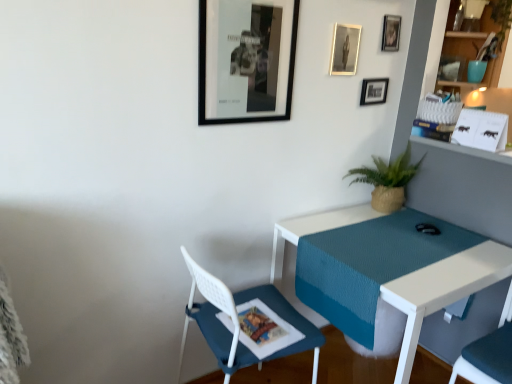
Question: Is fabric cushioned chair at lower right, the first chair from the right, smaller than black matte picture frame at upper center, the first picture frame when ordered from front to back?

Choices:
 (A) yes
 (B) no

Answer: (B)

Question: Would you say fabric cushioned chair at lower right, positioned as the 2th chair in left-to-right order, contains black matte picture frame at upper center, which is counted as the fourth picture frame, starting from the back?

Choices:
 (A) yes
 (B) no

Answer: (B)

Question: From a real-world perspective, is fabric cushioned chair at lower right, positioned as the 2th chair in left-to-right order, below black matte picture frame at upper center, the first picture frame when ordered from front to back?

Choices:
 (A) yes
 (B) no

Answer: (A)

Question: Would you say fabric cushioned chair at lower right, the first chair from the right, is outside black matte picture frame at upper center, positioned as the 1th picture frame in left-to-right order?

Choices:
 (A) no
 (B) yes

Answer: (B)

Question: Does fabric cushioned chair at lower right, the first chair from the right, lie in front of black matte picture frame at upper center, the first picture frame when ordered from front to back?

Choices:
 (A) yes
 (B) no

Answer: (A)

Question: Is fabric cushioned chair at lower right, positioned as the 2th chair in left-to-right order, positioned with its back to black matte picture frame at upper center, which is the 4th picture frame in right-to-left order?

Choices:
 (A) yes
 (B) no

Answer: (B)

Question: Is metallic silver picture frame at upper center, the 3th picture frame in the left-to-right sequence, thinner than metallic silver photo frame at upper center, which ranks as the second picture frame in front-to-back order?

Choices:
 (A) yes
 (B) no

Answer: (B)

Question: Considering the relative positions of metallic silver picture frame at upper center, marked as the second picture frame in a right-to-left arrangement, and metallic silver photo frame at upper center, which ranks as the second picture frame in front-to-back order, in the image provided, is metallic silver picture frame at upper center, marked as the second picture frame in a right-to-left arrangement, to the left of metallic silver photo frame at upper center, which ranks as the second picture frame in front-to-back order, from the viewer's perspective?

Choices:
 (A) yes
 (B) no

Answer: (B)

Question: Does metallic silver picture frame at upper center, the 3th picture frame in the left-to-right sequence, have a greater height compared to metallic silver photo frame at upper center, which appears as the 3th picture frame when viewed from the right?

Choices:
 (A) no
 (B) yes

Answer: (A)

Question: Are metallic silver picture frame at upper center, which ranks as the first picture frame in back-to-front order, and metallic silver photo frame at upper center, acting as the 3th picture frame starting from the back, making contact?

Choices:
 (A) yes
 (B) no

Answer: (B)

Question: Are metallic silver picture frame at upper center, marked as the second picture frame in a right-to-left arrangement, and metallic silver photo frame at upper center, acting as the 3th picture frame starting from the back, far apart?

Choices:
 (A) no
 (B) yes

Answer: (A)

Question: From a real-world perspective, is metallic silver picture frame at upper center, which ranks as the first picture frame in back-to-front order, on top of metallic silver photo frame at upper center, which ranks as the second picture frame in front-to-back order?

Choices:
 (A) yes
 (B) no

Answer: (B)

Question: Is white textured desk at center facing towards black matte picture frame at upper center, the first picture frame when ordered from front to back?

Choices:
 (A) no
 (B) yes

Answer: (A)